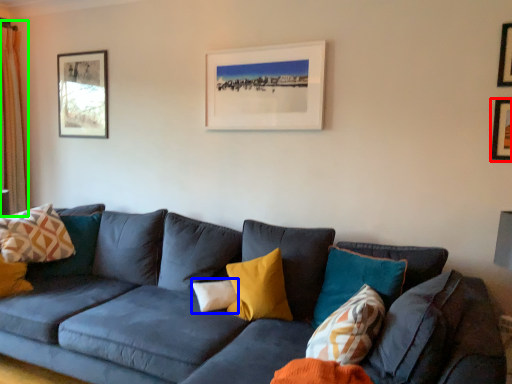
Question: Based on their relative distances, which object is nearer to picture frame (highlighted by a red box)? Choose from pillow (highlighted by a blue box) and curtain (highlighted by a green box).

Choices:
 (A) pillow
 (B) curtain

Answer: (A)